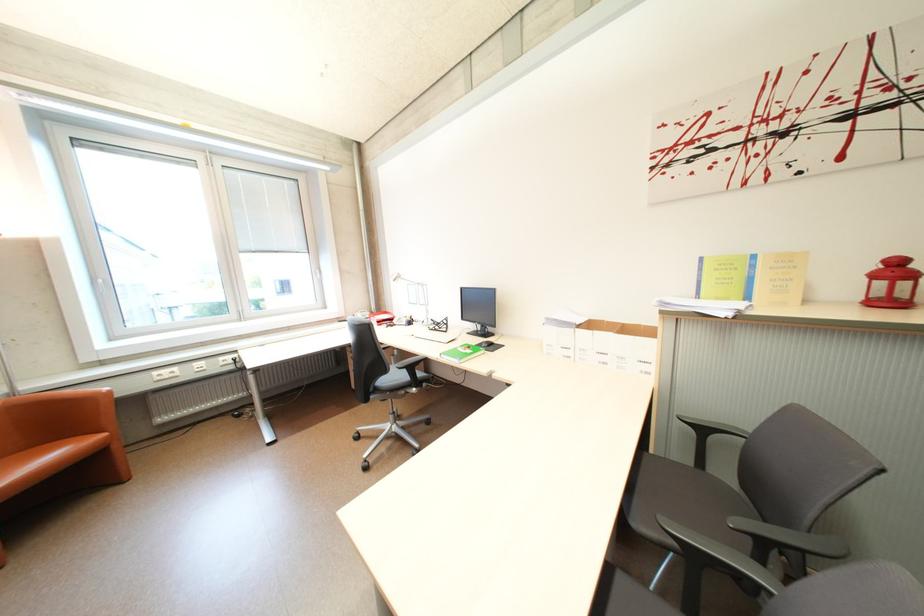
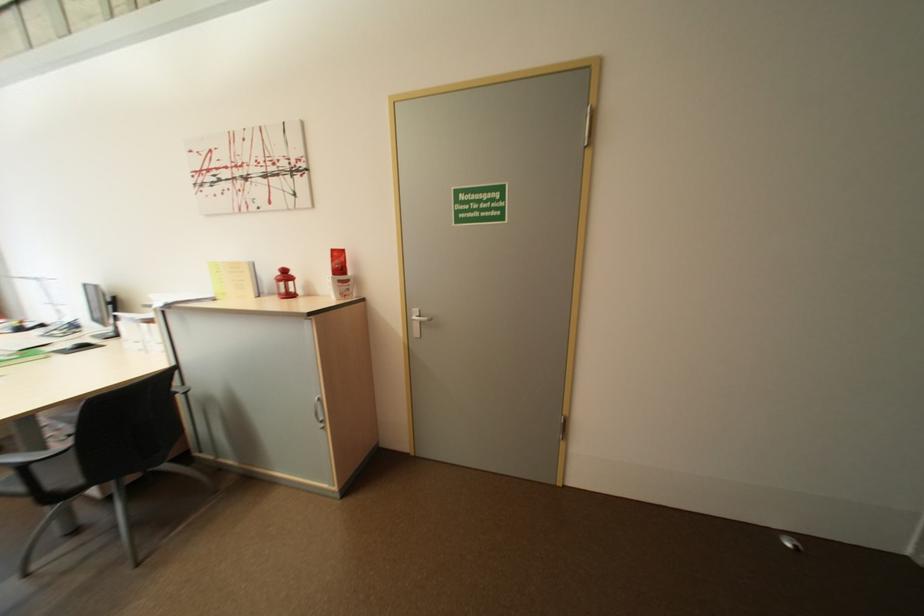
In a continuous first-person perspective shot, in which direction is the camera moving?

The movement direction of the cameraman is right, backward.